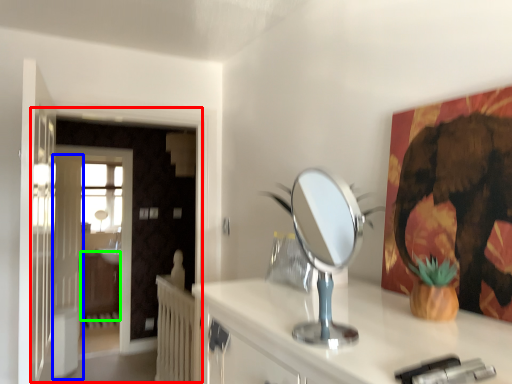
Question: Which object is the closest to the door (highlighted by a red box)? Choose among these: door (highlighted by a blue box) or dresser (highlighted by a green box).

Choices:
 (A) door
 (B) dresser

Answer: (A)